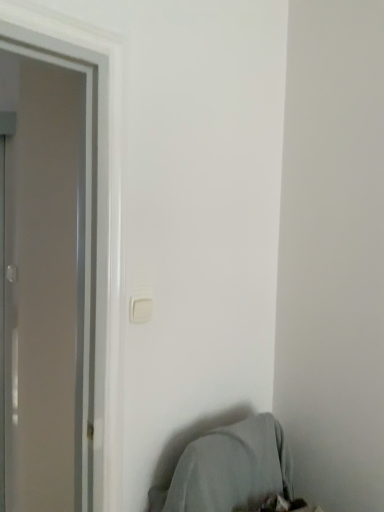
Identify the location of white plastic light switch at center. The height and width of the screenshot is (512, 384). (x=140, y=309).

Describe the element at coordinates (140, 309) in the screenshot. The width and height of the screenshot is (384, 512). I see `white plastic light switch at center` at that location.

This screenshot has height=512, width=384. What do you see at coordinates (232, 468) in the screenshot?
I see `gray fabric bean bag chair at lower right` at bounding box center [232, 468].

Measure the distance between point (231, 495) and camera.

The distance of point (231, 495) from camera is 3.96 feet.

At what (x,y) coordinates should I click in order to perform the action: click on gray fabric bean bag chair at lower right. Please return your answer as a coordinate pair (x, y). Looking at the image, I should click on (232, 468).

I want to click on white plastic light switch at center, so [140, 309].

Is white plastic light switch at center at the left side of gray fabric bean bag chair at lower right?

Correct, you'll find white plastic light switch at center to the left of gray fabric bean bag chair at lower right.

Is the position of white plastic light switch at center more distant than that of gray fabric bean bag chair at lower right?

Yes, it is.

Which point is more forward, (x=148, y=305) or (x=254, y=435)?

The point (x=148, y=305) is more forward.

From the image's perspective, between white plastic light switch at center and gray fabric bean bag chair at lower right, who is located below?

gray fabric bean bag chair at lower right.

From a real-world perspective, is white plastic light switch at center positioned over gray fabric bean bag chair at lower right based on gravity?

Yes.

Which object is wider, white plastic light switch at center or gray fabric bean bag chair at lower right?

With larger width is gray fabric bean bag chair at lower right.

Considering the relative sizes of white plastic light switch at center and gray fabric bean bag chair at lower right in the image provided, is white plastic light switch at center shorter than gray fabric bean bag chair at lower right?

Yes, white plastic light switch at center is shorter than gray fabric bean bag chair at lower right.

Does white plastic light switch at center have a smaller size compared to gray fabric bean bag chair at lower right?

Correct, white plastic light switch at center occupies less space than gray fabric bean bag chair at lower right.

Is white plastic light switch at center outside of gray fabric bean bag chair at lower right?

white plastic light switch at center is positioned outside gray fabric bean bag chair at lower right.

Is white plastic light switch at center placed right next to gray fabric bean bag chair at lower right?

white plastic light switch at center and gray fabric bean bag chair at lower right are not in contact.

Is white plastic light switch at center oriented away from gray fabric bean bag chair at lower right?

No, white plastic light switch at center's orientation is not away from gray fabric bean bag chair at lower right.

Locate an element on the screen. The height and width of the screenshot is (512, 384). light switch lying on the left of gray fabric bean bag chair at lower right is located at coordinates (140, 309).

Which is more to the left, gray fabric bean bag chair at lower right or white plastic light switch at center?

From the viewer's perspective, white plastic light switch at center appears more on the left side.

Considering the positions of objects gray fabric bean bag chair at lower right and white plastic light switch at center in the image provided, who is behind, gray fabric bean bag chair at lower right or white plastic light switch at center?

white plastic light switch at center.

Which is in front, point (207, 498) or point (139, 301)?

The point (139, 301) is more forward.

From the image's perspective, does gray fabric bean bag chair at lower right appear lower than white plastic light switch at center?

Yes, from the image's perspective, gray fabric bean bag chair at lower right is beneath white plastic light switch at center.

From a real-world perspective, relative to white plastic light switch at center, is gray fabric bean bag chair at lower right vertically above or below?

In terms of real-world spatial position, gray fabric bean bag chair at lower right is below white plastic light switch at center.

Can you confirm if gray fabric bean bag chair at lower right is wider than white plastic light switch at center?

Yes.

Which of these two, gray fabric bean bag chair at lower right or white plastic light switch at center, stands shorter?

Standing shorter between the two is white plastic light switch at center.

Considering the relative sizes of gray fabric bean bag chair at lower right and white plastic light switch at center in the image provided, is gray fabric bean bag chair at lower right smaller than white plastic light switch at center?

No, gray fabric bean bag chair at lower right is not smaller than white plastic light switch at center.

Is white plastic light switch at center inside gray fabric bean bag chair at lower right?

No, gray fabric bean bag chair at lower right does not contain white plastic light switch at center.

Is gray fabric bean bag chair at lower right positioned far away from white plastic light switch at center?

gray fabric bean bag chair at lower right is near white plastic light switch at center, not far away.

Is gray fabric bean bag chair at lower right looking in the opposite direction of white plastic light switch at center?

No, gray fabric bean bag chair at lower right's orientation is not away from white plastic light switch at center.

How different are the orientations of gray fabric bean bag chair at lower right and white plastic light switch at center in degrees?

1.24 degrees separate the facing orientations of gray fabric bean bag chair at lower right and white plastic light switch at center.

Find the location of a particular element. light switch on the left side of gray fabric bean bag chair at lower right is located at coordinates (140, 309).

At what (x,y) coordinates should I click in order to perform the action: click on light switch above the gray fabric bean bag chair at lower right (from a real-world perspective). Please return your answer as a coordinate pair (x, y). Image resolution: width=384 pixels, height=512 pixels. Looking at the image, I should click on (140, 309).

This screenshot has width=384, height=512. I want to click on light switch above the gray fabric bean bag chair at lower right (from the image's perspective), so click(140, 309).